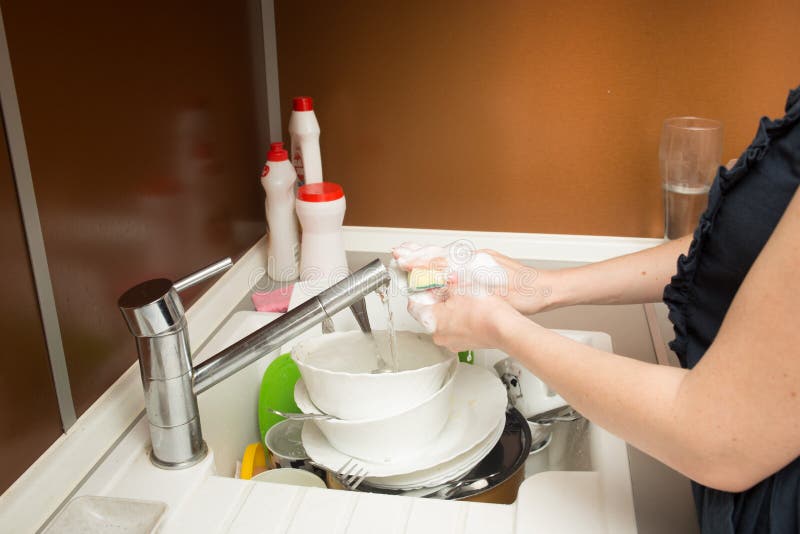
The width and height of the screenshot is (800, 534). In order to click on sponges in this screenshot , I will do pyautogui.click(x=272, y=300), pyautogui.click(x=426, y=279).